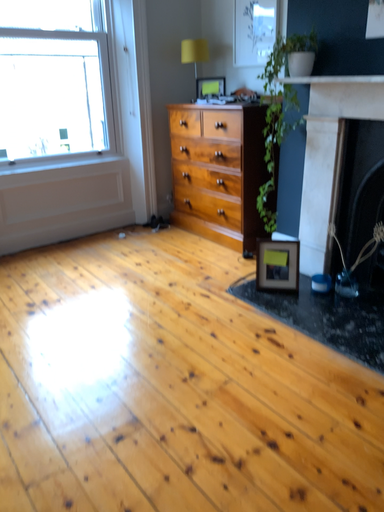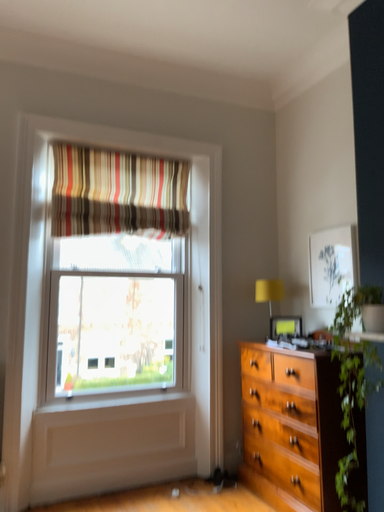
Question: Which way did the camera rotate in the video?

Choices:
 (A) rotated upward
 (B) rotated downward

Answer: (A)